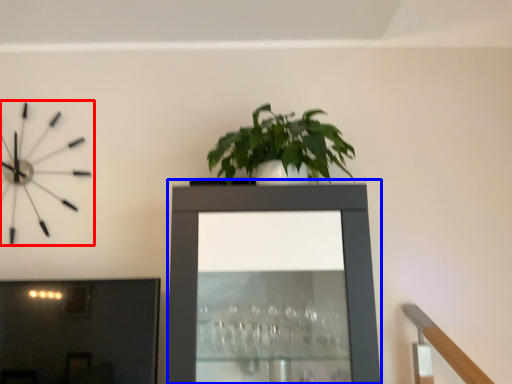
Question: Which of the following is the farthest to the observer, wall clock (highlighted by a red box) or tv cabinet (highlighted by a blue box)?

Choices:
 (A) wall clock
 (B) tv cabinet

Answer: (A)